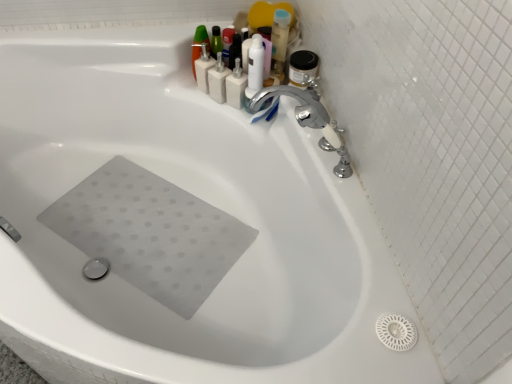
Question: Is matte black pump bottle at upper center, marked as the third toiletry in a left-to-right arrangement, surrounded by white plastic soap dispenser at upper center, marked as the first toiletry in a left-to-right arrangement?

Choices:
 (A) no
 (B) yes

Answer: (A)

Question: Is white plastic soap dispenser at upper center, which ranks as the fourth toiletry in right-to-left order, oriented towards matte black pump bottle at upper center, arranged as the 2th toiletry when viewed from the right?

Choices:
 (A) no
 (B) yes

Answer: (A)

Question: Considering the relative sizes of white plastic soap dispenser at upper center, which ranks as the fourth toiletry in right-to-left order, and matte black pump bottle at upper center, arranged as the 2th toiletry when viewed from the right, in the image provided, is white plastic soap dispenser at upper center, which ranks as the fourth toiletry in right-to-left order, smaller than matte black pump bottle at upper center, arranged as the 2th toiletry when viewed from the right,?

Choices:
 (A) yes
 (B) no

Answer: (B)

Question: Is white plastic soap dispenser at upper center, which ranks as the fourth toiletry in right-to-left order, outside of matte black pump bottle at upper center, arranged as the 2th toiletry when viewed from the right?

Choices:
 (A) yes
 (B) no

Answer: (A)

Question: Is the depth of white plastic soap dispenser at upper center, which ranks as the fourth toiletry in right-to-left order, greater than that of matte black pump bottle at upper center, arranged as the 2th toiletry when viewed from the right?

Choices:
 (A) no
 (B) yes

Answer: (A)

Question: Is matte black pump bottle at upper center, arranged as the 2th toiletry when viewed from the right, in front of or behind white plastic pump at upper center, the fourth toiletry in the left-to-right sequence, in the image?

Choices:
 (A) front
 (B) behind

Answer: (B)

Question: Considering the positions of point (225, 56) and point (239, 105), is point (225, 56) closer or farther from the camera than point (239, 105)?

Choices:
 (A) farther
 (B) closer

Answer: (B)

Question: Based on their sizes in the image, would you say matte black pump bottle at upper center, arranged as the 2th toiletry when viewed from the right, is bigger or smaller than white plastic pump at upper center, the fourth toiletry in the left-to-right sequence?

Choices:
 (A) big
 (B) small

Answer: (B)

Question: Do you think matte black pump bottle at upper center, arranged as the 2th toiletry when viewed from the right, is within white plastic pump at upper center, which is counted as the 1th toiletry, starting from the right, or outside of it?

Choices:
 (A) inside
 (B) outside

Answer: (B)

Question: In terms of width, does silver metallic faucet at upper right, the 2th tap viewed from the front, look wider or thinner when compared to white plastic pump at upper center, which is counted as the 1th toiletry, starting from the right?

Choices:
 (A) wide
 (B) thin

Answer: (A)

Question: Considering the positions of silver metallic faucet at upper right, the 2th tap viewed from the front, and white plastic pump at upper center, the fourth toiletry in the left-to-right sequence, in the image, is silver metallic faucet at upper right, the 2th tap viewed from the front, bigger or smaller than white plastic pump at upper center, the fourth toiletry in the left-to-right sequence,?

Choices:
 (A) big
 (B) small

Answer: (A)

Question: Does point pyautogui.click(x=320, y=109) appear closer or farther from the camera than point pyautogui.click(x=240, y=71)?

Choices:
 (A) farther
 (B) closer

Answer: (B)

Question: In the image, is silver metallic faucet at upper right, the 2th tap viewed from the front, on the left side or the right side of white plastic pump at upper center, the fourth toiletry in the left-to-right sequence?

Choices:
 (A) left
 (B) right

Answer: (B)

Question: Considering the positions of point (220, 99) and point (226, 82), is point (220, 99) closer or farther from the camera than point (226, 82)?

Choices:
 (A) closer
 (B) farther

Answer: (B)

Question: Is white matte bottles at upper center, which is the 2th toiletry from left to right, bigger or smaller than white plastic pump at upper center, which is counted as the 1th toiletry, starting from the right?

Choices:
 (A) small
 (B) big

Answer: (B)